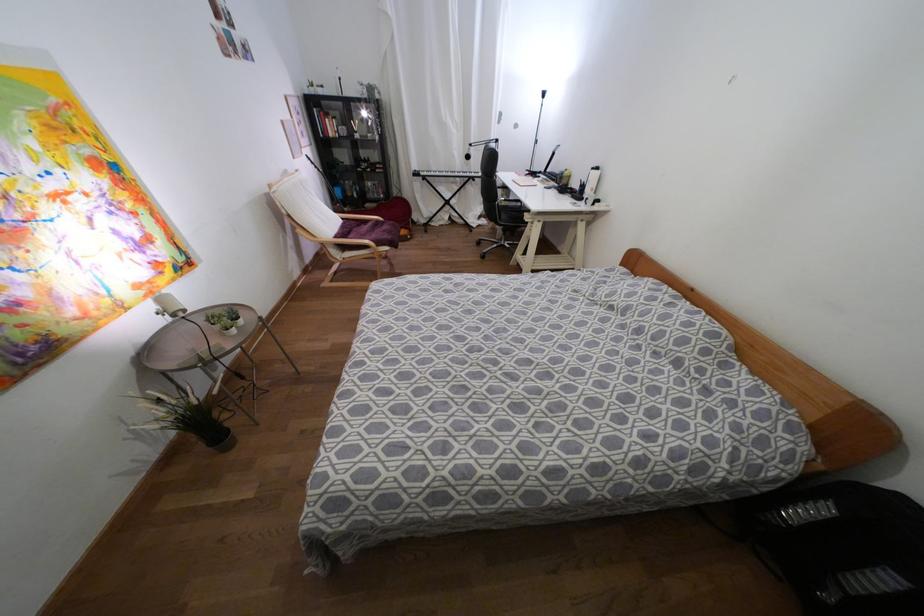
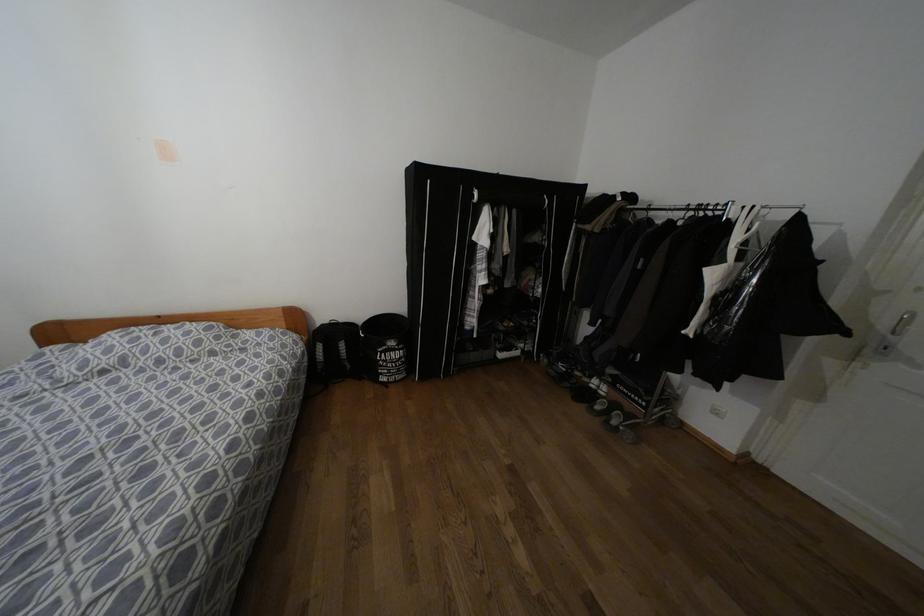
In the second image, find the point that corresponds to point (888, 580) in the first image.

(342, 345)